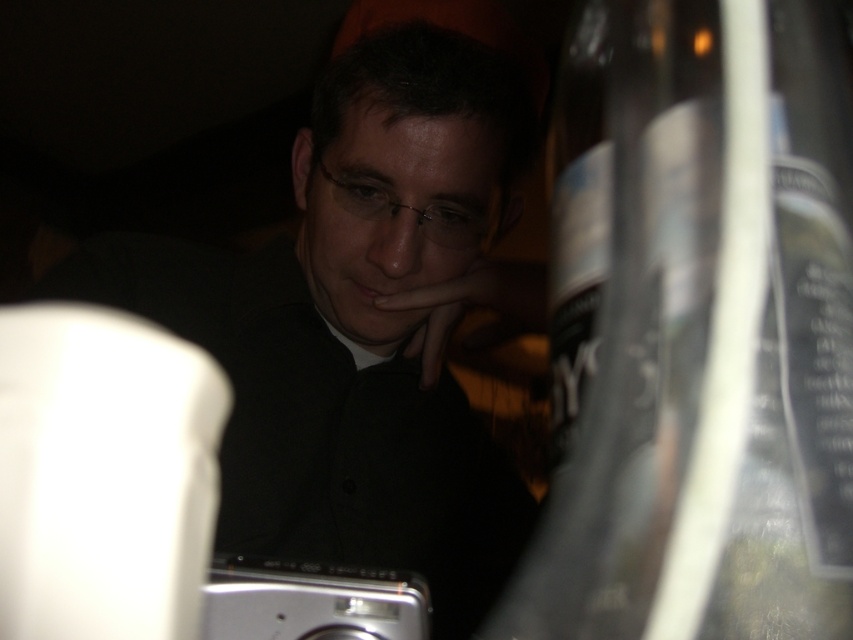
Is transparent plastic bottle at center-right taller than silver metallic camera at lower center?

Indeed, transparent plastic bottle at center-right has a greater height compared to silver metallic camera at lower center.

Can you confirm if transparent plastic bottle at center-right is positioned below silver metallic camera at lower center?

No, transparent plastic bottle at center-right is not below silver metallic camera at lower center.

Where is `transparent plastic bottle at center-right`? transparent plastic bottle at center-right is located at coordinates (701, 333).

Which of these two, transparent plastic bottle at center-right or matte black shirt at center, stands taller?

Standing taller between the two is matte black shirt at center.

Is transparent plastic bottle at center-right above matte black shirt at center?

Incorrect, transparent plastic bottle at center-right is not positioned above matte black shirt at center.

Is point (633, 326) positioned before point (376, 346)?

Yes, it is.

Locate an element on the screen. This screenshot has width=853, height=640. transparent plastic bottle at center-right is located at coordinates (701, 333).

Between point (361, 406) and point (236, 563), which one is positioned in front?

Positioned in front is point (236, 563).

From the picture: Is matte black shirt at center below silver metallic camera at lower center?

No.

Is point (239, 324) in front of point (212, 593)?

No.

The height and width of the screenshot is (640, 853). In order to click on matte black shirt at center in this screenshot , I will do click(357, 324).